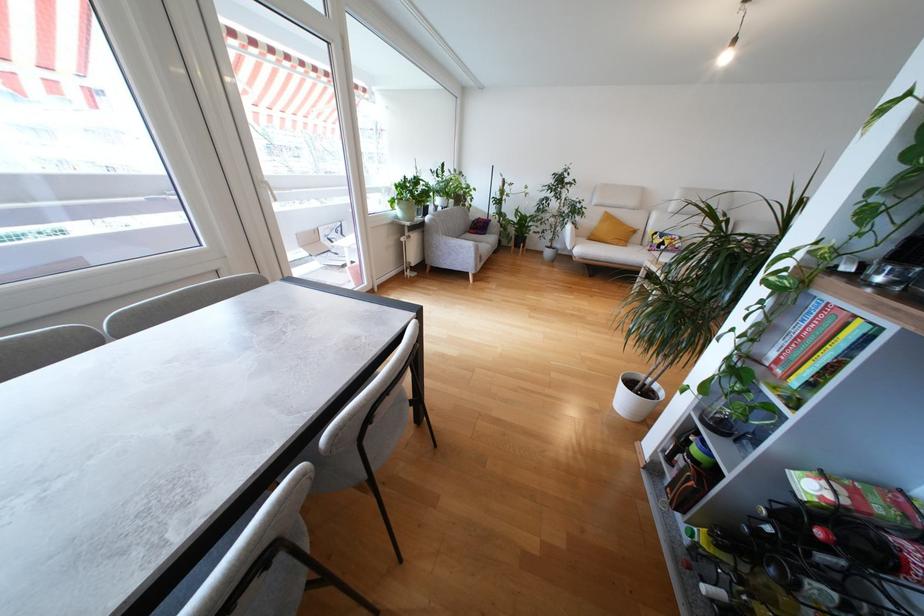
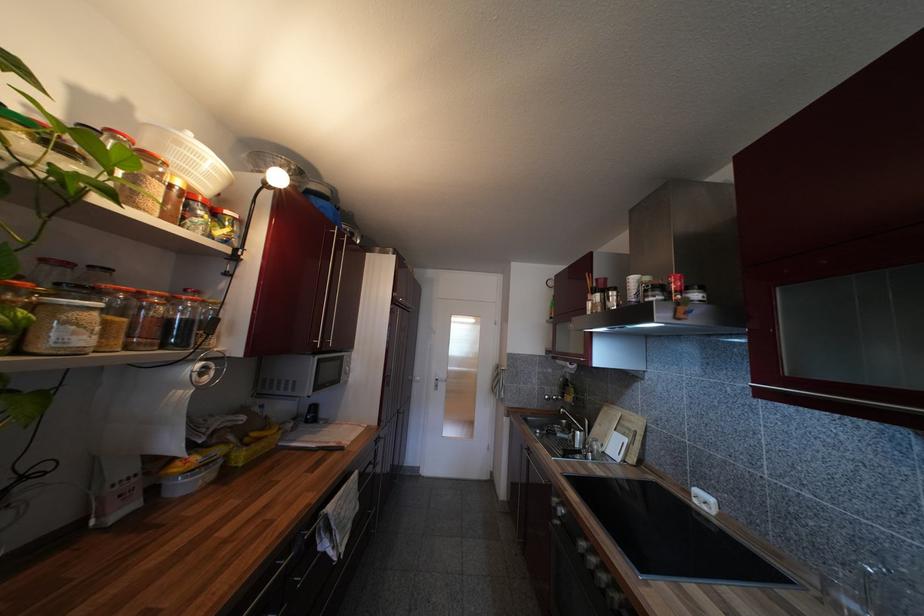
Question: Based on the continuous images, in which direction is the camera rotating? Reply with the corresponding letter.

Choices:
 (A) Left
 (B) Right
 (C) Up
 (D) Down

Answer: (B)